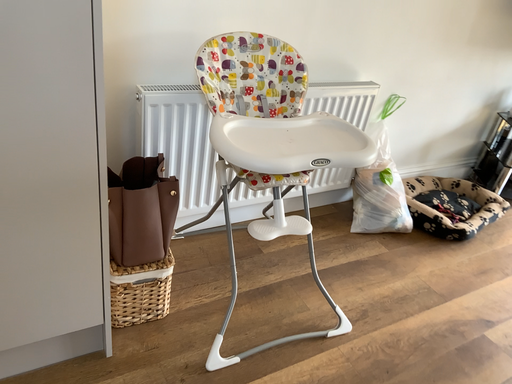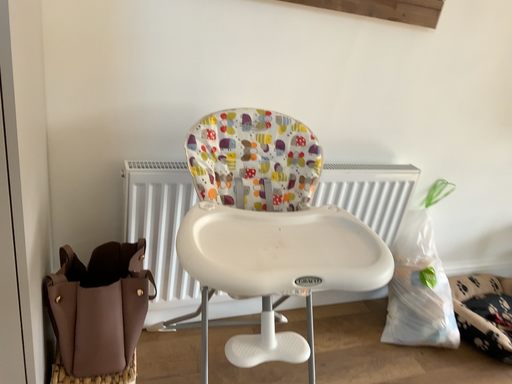
Question: How did the camera likely rotate when shooting the video?

Choices:
 (A) rotated downward
 (B) rotated upward

Answer: (B)